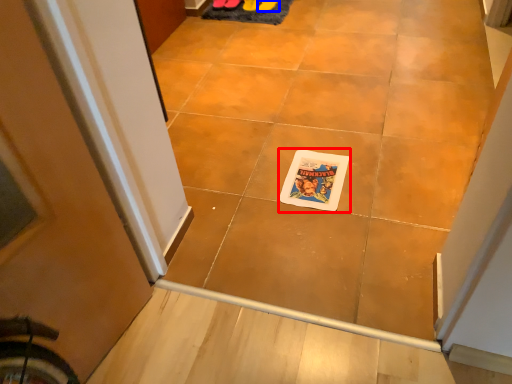
Question: Among these objects, which one is farthest to the camera, comic book character (highlighted by a red box) or footwear (highlighted by a blue box)?

Choices:
 (A) comic book character
 (B) footwear

Answer: (B)